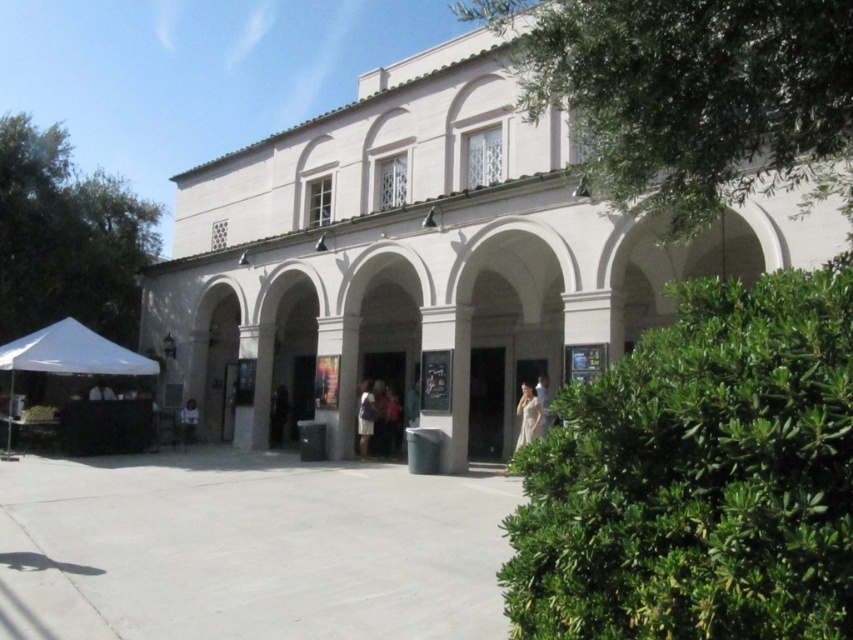
You are planning to set up a temporary shelter for an outdoor event. You have a white silk dress at center and a white fabric canopy at lower left. Which object can provide better coverage for a group of people?

The white fabric canopy at lower left is bigger than the white silk dress at center, so it can provide better coverage for a group of people.

You are standing in front of the building and want to place a small bench exactly at the center of the paved area. According to the image, where should you place the bench relative to the green leafy bush at center?

The green leafy bush at center is located at point (699, 476), so the bench should be placed at the center of the paved area, which is likely near the middle of the image. However, the exact coordinates for the bench placement would depend on the paved area dimensions not provided here.